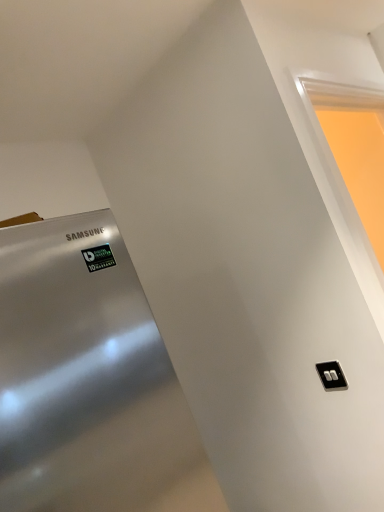
Where is `black plastic/light switch at lower right`? The width and height of the screenshot is (384, 512). black plastic/light switch at lower right is located at coordinates (332, 376).

Describe the element at coordinates (332, 376) in the screenshot. I see `black plastic/light switch at lower right` at that location.

Image resolution: width=384 pixels, height=512 pixels. Describe the element at coordinates (355, 151) in the screenshot. I see `matte white frame at upper right` at that location.

What is the approximate height of matte white frame at upper right?

It is 29.73 inches.

Where is `matte white frame at upper right`? This screenshot has width=384, height=512. matte white frame at upper right is located at coordinates (x=355, y=151).

The image size is (384, 512). Identify the location of black plastic/light switch at lower right. (332, 376).

Considering the positions of objects matte white frame at upper right and black plastic/light switch at lower right in the image provided, who is more to the right, matte white frame at upper right or black plastic/light switch at lower right?

Positioned to the right is matte white frame at upper right.

Is the position of matte white frame at upper right more distant than that of black plastic/light switch at lower right?

No, matte white frame at upper right is in front of black plastic/light switch at lower right.

Which is less distant, (373, 123) or (323, 377)?

The point (323, 377) is in front.

From the image's perspective, is matte white frame at upper right positioned above or below black plastic/light switch at lower right?

From the image's perspective, matte white frame at upper right appears above black plastic/light switch at lower right.

From a real-world perspective, between matte white frame at upper right and black plastic/light switch at lower right, who is vertically higher?

In real-world perspective, matte white frame at upper right is above.

Is matte white frame at upper right wider or thinner than black plastic/light switch at lower right?

In the image, matte white frame at upper right appears to be wider than black plastic/light switch at lower right.

Is matte white frame at upper right taller than black plastic/light switch at lower right?

Correct, matte white frame at upper right is much taller as black plastic/light switch at lower right.

Can you confirm if matte white frame at upper right is bigger than black plastic/light switch at lower right?

Yes, matte white frame at upper right is bigger than black plastic/light switch at lower right.

Is black plastic/light switch at lower right completely or partially inside matte white frame at upper right?

No.

Based on the photo, is matte white frame at upper right far away from black plastic/light switch at lower right?

matte white frame at upper right is positioned a significant distance from black plastic/light switch at lower right.

Could you tell me if matte white frame at upper right is facing black plastic/light switch at lower right?

No, matte white frame at upper right is not aimed at black plastic/light switch at lower right.

How many degrees apart are the facing directions of matte white frame at upper right and black plastic/light switch at lower right?

The angular difference between matte white frame at upper right and black plastic/light switch at lower right is 89 degrees.

I want to click on light switch directly beneath the matte white frame at upper right (from a real-world perspective), so click(x=332, y=376).

Considering the positions of objects black plastic/light switch at lower right and matte white frame at upper right in the image provided, who is more to the right, black plastic/light switch at lower right or matte white frame at upper right?

Positioned to the right is matte white frame at upper right.

Is black plastic/light switch at lower right further to the viewer compared to matte white frame at upper right?

Yes, it is behind matte white frame at upper right.

Consider the image. Which point is more distant from viewer, (325, 374) or (375, 100)?

The point (375, 100) is farther from the camera.

From the image's perspective, between black plastic/light switch at lower right and matte white frame at upper right, which one is located above?

matte white frame at upper right.

From a real-world perspective, between black plastic/light switch at lower right and matte white frame at upper right, who is vertically lower?

black plastic/light switch at lower right is physically lower.

Between black plastic/light switch at lower right and matte white frame at upper right, which one has smaller width?

black plastic/light switch at lower right.

Is black plastic/light switch at lower right taller or shorter than matte white frame at upper right?

In the image, black plastic/light switch at lower right appears to be shorter than matte white frame at upper right.

Between black plastic/light switch at lower right and matte white frame at upper right, which one has larger size?

matte white frame at upper right.

Is black plastic/light switch at lower right inside or outside of matte white frame at upper right?

black plastic/light switch at lower right lies outside matte white frame at upper right.

Is black plastic/light switch at lower right beside matte white frame at upper right?

No, black plastic/light switch at lower right is not beside matte white frame at upper right.

Is matte white frame at upper right at the back of black plastic/light switch at lower right?

No.

Identify the location of light switch located on the left of matte white frame at upper right. (332, 376).

Locate an element on the screen. window above the black plastic/light switch at lower right (from the image's perspective) is located at coordinates (355, 151).

Locate an element on the screen. The width and height of the screenshot is (384, 512). light switch lying below the matte white frame at upper right (from the image's perspective) is located at coordinates (332, 376).